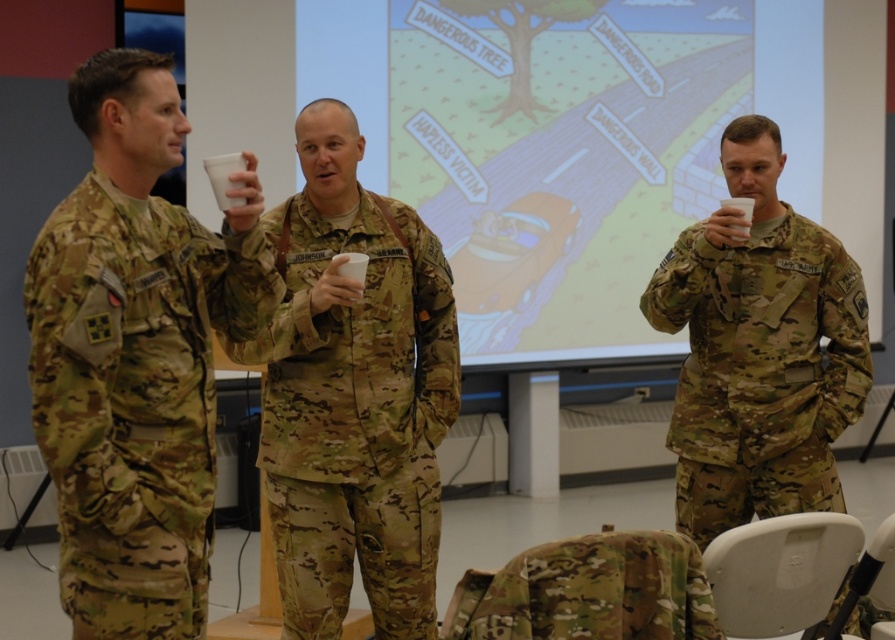
Question: Observing the image, what is the correct spatial positioning of camouflage fabric uniform at left in reference to camouflage uniform at center?

Choices:
 (A) below
 (B) above

Answer: (B)

Question: Which of the following is the farthest from the observer?

Choices:
 (A) (388, 627)
 (B) (662, 76)
 (C) (124, 413)

Answer: (B)

Question: Which of the following is the farthest from the observer?

Choices:
 (A) (354, 509)
 (B) (201, 481)
 (C) (550, 333)
 (D) (800, 310)

Answer: (C)

Question: Based on their relative distances, which object is nearer to the camo fabric uniform at center?

Choices:
 (A) camouflage uniform at center
 (B) matte plastic projection screen at center
 (C) camouflage fabric uniform at left

Answer: (C)

Question: Does camouflage fabric uniform at left have a smaller size compared to camouflage uniform at center?

Choices:
 (A) yes
 (B) no

Answer: (A)

Question: Is matte plastic projection screen at center to the right of camouflage uniform at center from the viewer's perspective?

Choices:
 (A) no
 (B) yes

Answer: (A)